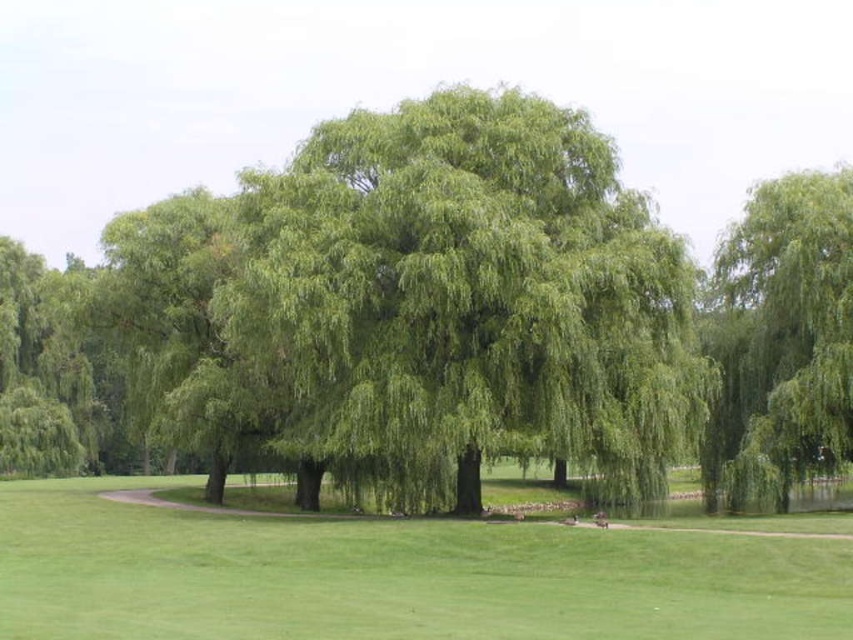
Does green leafy willow at center have a greater width compared to green grass at center?

In fact, green leafy willow at center might be narrower than green grass at center.

Can you confirm if green leafy willow at center is taller than green grass at center?

Correct, green leafy willow at center is much taller as green grass at center.

Between point (352, 122) and point (699, 566), which one is positioned behind?

The point (352, 122) is behind.

The height and width of the screenshot is (640, 853). I want to click on green leafy willow at center, so click(468, 292).

Can you confirm if green grass at center is taller than green leafy willow at upper right?

No, green grass at center is not taller than green leafy willow at upper right.

Is point (575, 636) more distant than point (737, 230)?

No, it is in front of (737, 230).

This screenshot has width=853, height=640. Find the location of `green grass at center`. green grass at center is located at coordinates (392, 577).

Does green leafy willow at center appear under green leafy willow at upper right?

Incorrect, green leafy willow at center is not positioned below green leafy willow at upper right.

Can you confirm if green leafy willow at center is taller than green leafy willow at upper right?

In fact, green leafy willow at center may be shorter than green leafy willow at upper right.

Image resolution: width=853 pixels, height=640 pixels. What are the coordinates of `green leafy willow at center` in the screenshot? It's located at (468, 292).